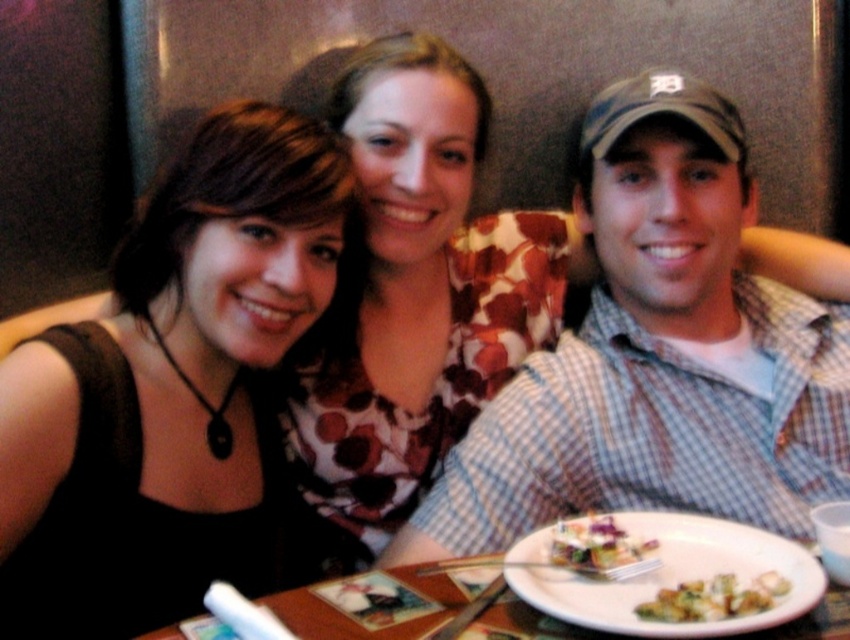
You are a waiter at the restaurant and need to deliver a drink to the table. The drink should be placed on the white plate at center. However, there is a checkered fabric shirt at center in the way. Can you place the drink on the plate without moving the shirt?

The checkered fabric shirt at center is further to the viewer than the white plate at center, so the shirt is closer to you. This means the shirt is blocking the plate, making it impossible to place the drink on the plate without moving the shirt.

You are standing in front of the restaurant booth where three people are sitting. There is a point at coordinates (638,205). If you want to place a napkin at that point, will it be within reach of the person on the left wearing a black sleeveless top?

The point at coordinates (638,205) is 3.88 feet from the viewer. Since the person on the left is seated at the booth and the distance is 3.88 feet, it is likely within their reach if they can comfortably extend their arm that far, but this depends on their seating position and arm length.

You are a photographer standing in front of the restaurant booth. You want to take a photo of the three people seated at the booth. Given that your camera has a minimum focusing distance of 36 inches, will you need to step back to ensure the black fabric dress at left is in focus?

The distance between the black fabric dress at left and the viewer is 35.21 inches, which is less than the camera minimum focusing distance of 36 inches. Therefore, you need to step back to ensure the black fabric dress at left is in focus.